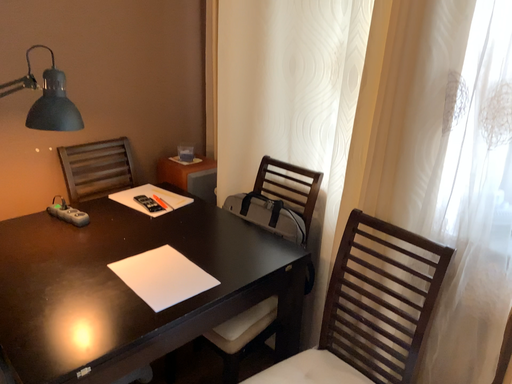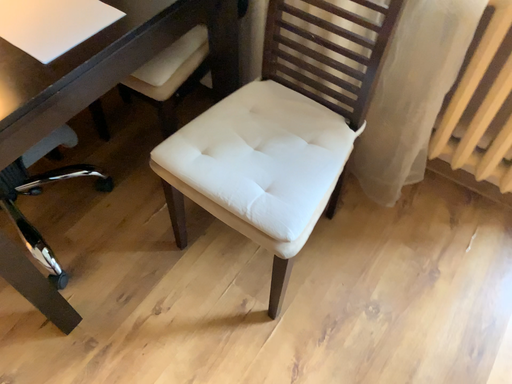
Question: How did the camera likely rotate when shooting the video?

Choices:
 (A) rotated right
 (B) rotated left

Answer: (A)